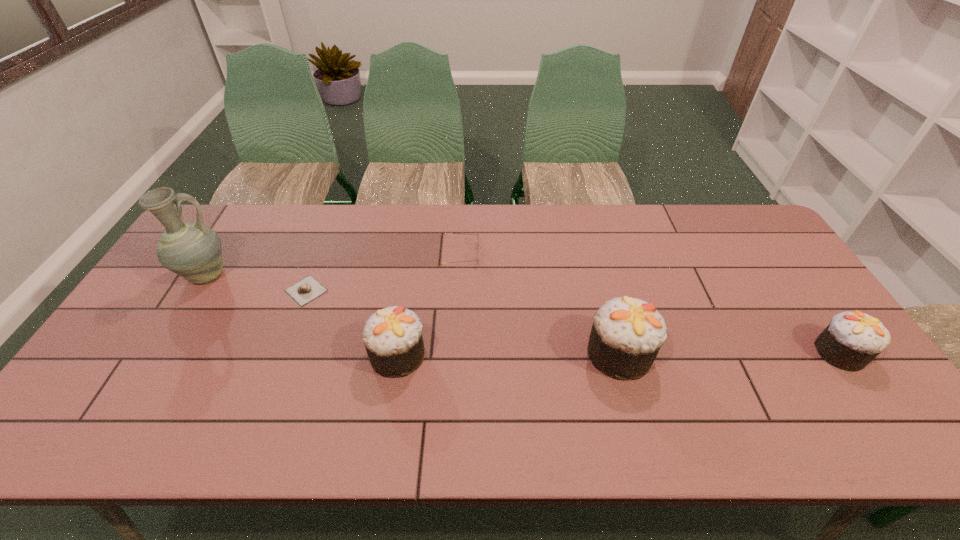
This screenshot has width=960, height=540. Find the location of `free spot between the leftmost object and the garlic`. free spot between the leftmost object and the garlic is located at coordinates (256, 283).

Locate an element on the screen. This screenshot has width=960, height=540. free spot between the rightmost object and the second cupcake from right to left is located at coordinates click(730, 353).

I want to click on vacant area that lies between the shortest object and the pitcher, so click(x=256, y=283).

The image size is (960, 540). What are the coordinates of `free spot between the fourth shortest object and the third object from right to left` in the screenshot? It's located at (429, 305).

At what (x,y) coordinates should I click in order to perform the action: click on the fourth closest object to the shortest object. Please return your answer as a coordinate pair (x, y). The height and width of the screenshot is (540, 960). Looking at the image, I should click on (627, 333).

Identify which object is the third nearest to the leftmost object. Please provide its 2D coordinates. Your answer should be formatted as a tuple, i.e. [(x, y)], where the tuple contains the x and y coordinates of a point satisfying the conditions above.

[(445, 233)]

Identify which cupcake is located as the second nearest to the second object from right to left. Please provide its 2D coordinates. Your answer should be formatted as a tuple, i.e. [(x, y)], where the tuple contains the x and y coordinates of a point satisfying the conditions above.

[(852, 340)]

Find the location of a particular element. This screenshot has width=960, height=540. cupcake that stands as the second closest to the leftmost object is located at coordinates (627, 333).

Image resolution: width=960 pixels, height=540 pixels. What are the coordinates of `vacant region that satisfies the following two spatial constraints: 1. on the temples of the spectacles; 2. on the front side of the leftmost cupcake` in the screenshot? It's located at (455, 355).

The image size is (960, 540). Identify the location of vacant region that satisfies the following two spatial constraints: 1. on the temples of the second shortest object; 2. on the left side of the second cupcake from left to right. (456, 354).